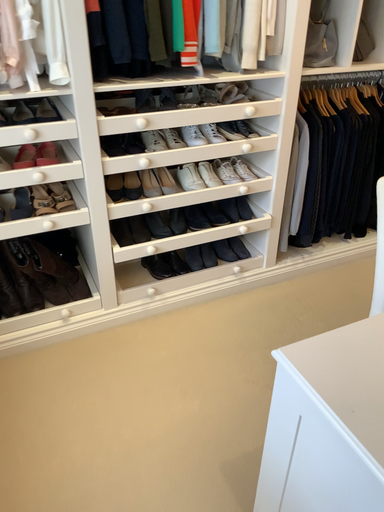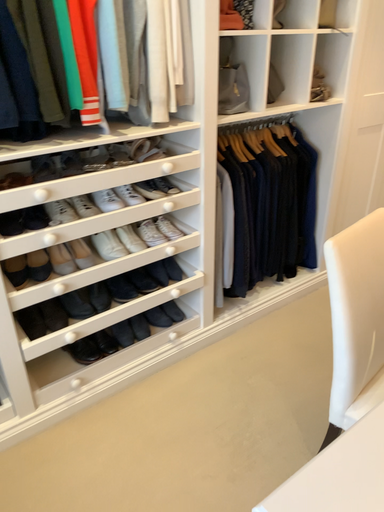
Question: How did the camera likely rotate when shooting the video?

Choices:
 (A) rotated left
 (B) rotated right

Answer: (B)